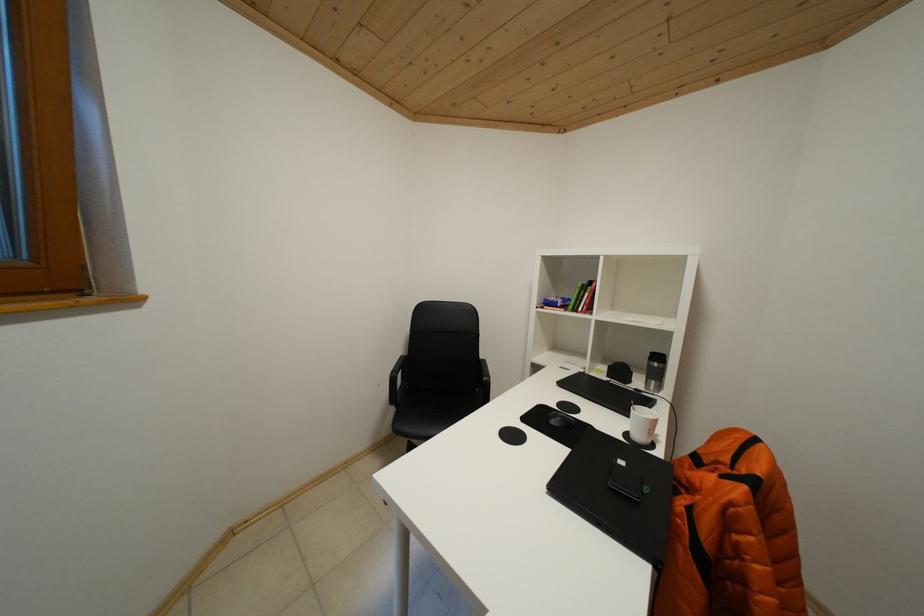
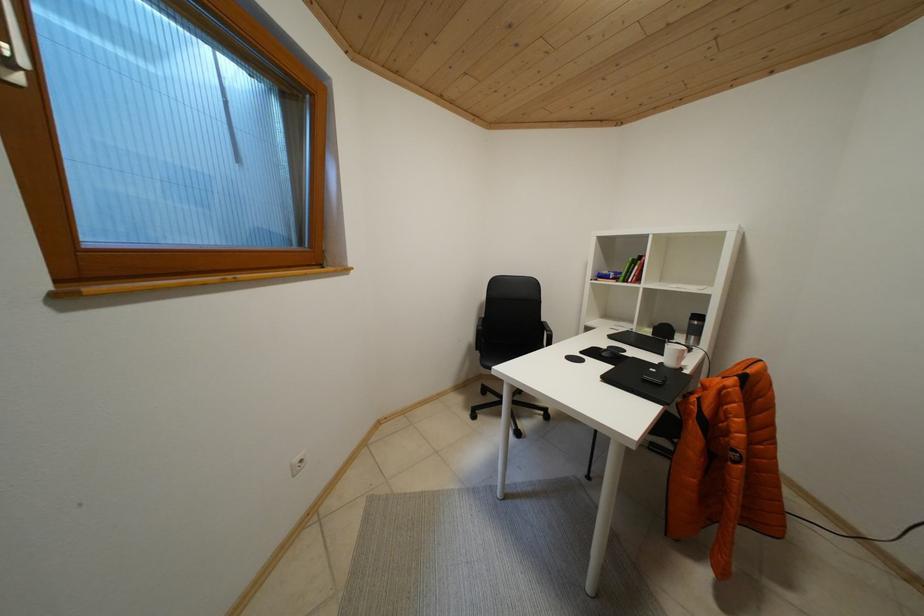
Question: Based on the continuous images, in which direction is the camera rotating? Reply with the corresponding letter.

Choices:
 (A) Left
 (B) Right
 (C) Up
 (D) Down

Answer: (A)